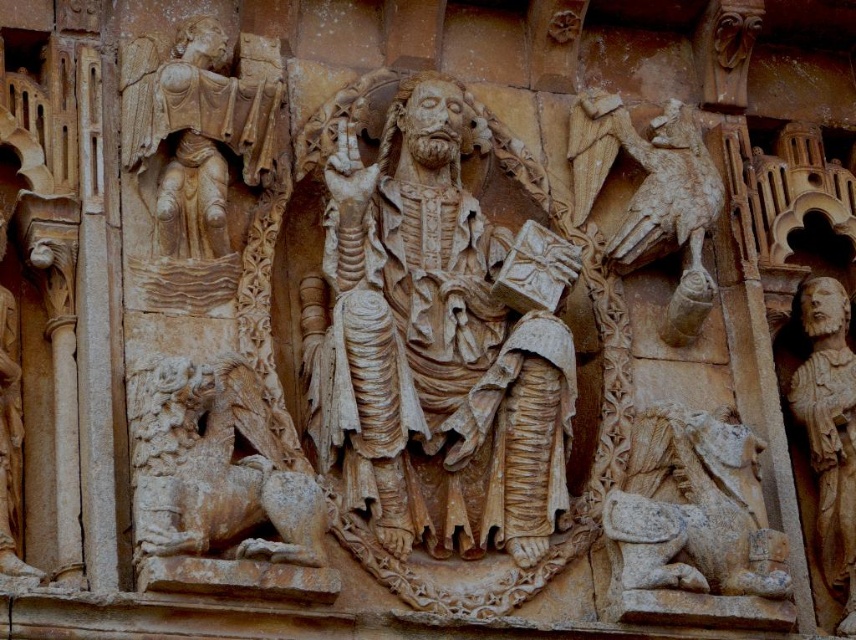
In the stone relief sculpture, there are two figures, the beige stone lion at lower right and the beige stone angel at upper left. Which of these two figures is larger in size?

The beige stone lion at lower right is bigger than the beige stone angel at upper left.

Based on the scene description, which object is wider between the carved stone figure at center and the carved stone lion at lower left?

The carved stone figure at center is wider than the carved stone lion at lower left according to the description.

Looking at the stone relief sculpture, where is the carved stone figure at center in relation to the beige stone figure at right?

The carved stone figure at center is to the left of the beige stone figure at right.